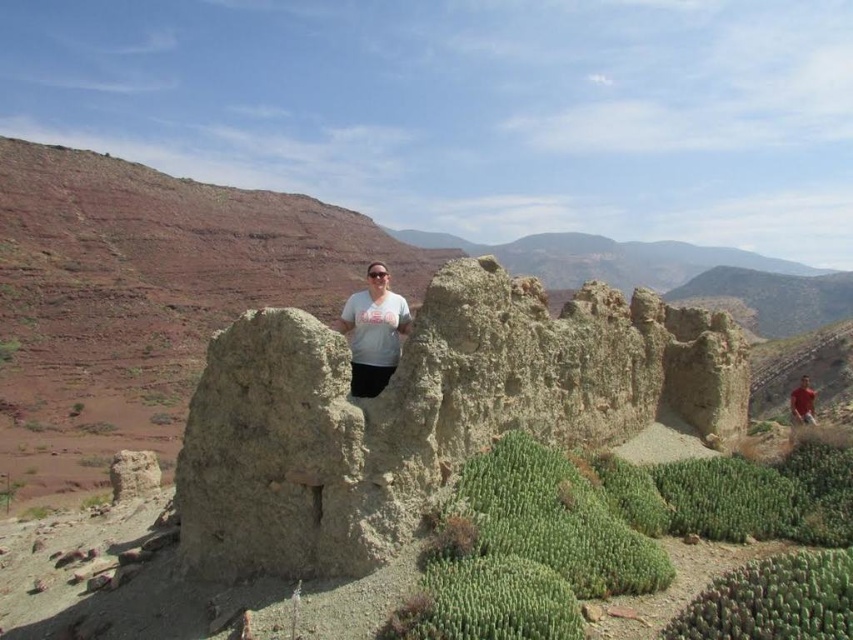
From the picture: You are a photographer trying to capture the light beige stone wall at center and the red cotton shirt at right in your shot. Which object takes up more area in the photo?

The red cotton shirt at right occupies more space than the light beige stone wall at center in the photo.